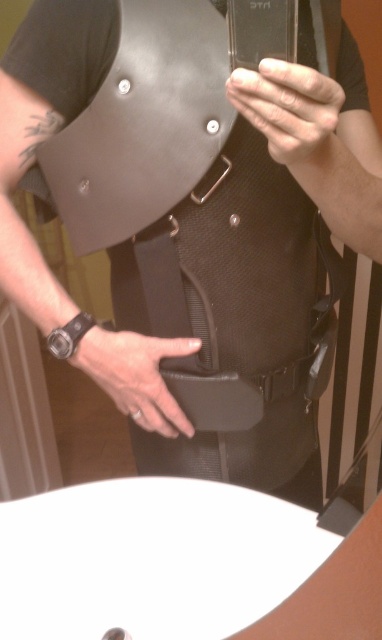
Question: Does smooth skin hand at upper center have a larger size compared to leather at center?

Choices:
 (A) no
 (B) yes

Answer: (A)

Question: Is smooth skin hand at upper center smaller than leather at center?

Choices:
 (A) yes
 (B) no

Answer: (A)

Question: Among these objects, which one is farthest from the camera?

Choices:
 (A) leather at center
 (B) smooth skin hand at upper center

Answer: (A)

Question: Does smooth skin hand at upper center have a smaller size compared to leather at center?

Choices:
 (A) no
 (B) yes

Answer: (B)

Question: Among these objects, which one is farthest from the camera?

Choices:
 (A) leather at center
 (B) smooth skin hand at upper center

Answer: (A)